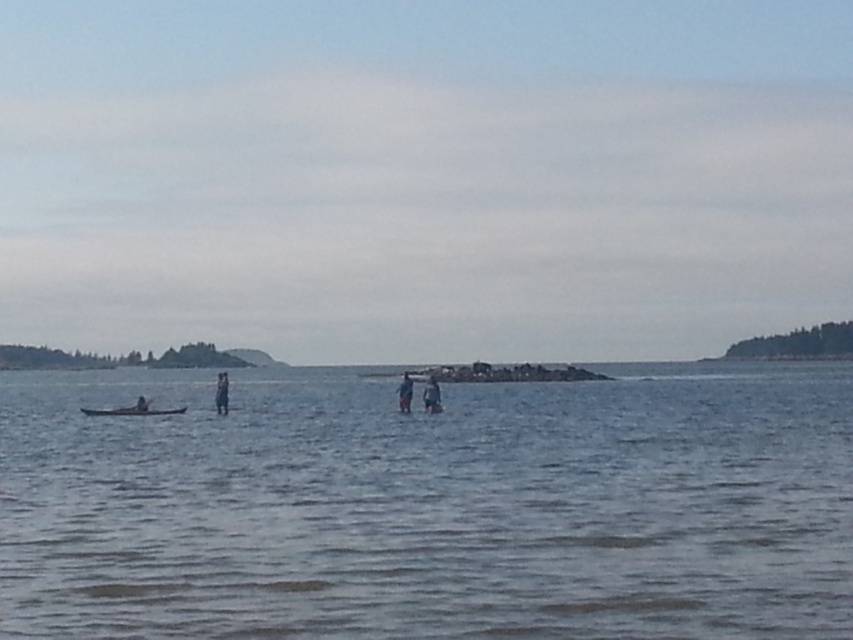
You are a photographer trying to capture the clear water at center and the dark blue fabric at center in the same frame. Based on their positions, which object should you adjust your camera to focus on first to ensure both are in the shot?

The clear water at center is positioned on the left side of dark blue fabric at center. Therefore, you should focus on the dark blue fabric at center first since it is on the right and might be further away, ensuring both are captured in the frame.

You are a photographer trying to capture the smooth brown canoe at lower left and the clear water at center in the same frame. Based on their positions, which one will occupy more horizontal space in the photo?

The clear water at center will occupy more horizontal space in the photo because its width surpasses that of the smooth brown canoe at lower left.

You are a photographer trying to capture a photo of the smooth brown canoe at lower left and the clear water at center. From your current position, which object should you adjust your camera to focus on first if you want to include both in the frame without moving your position?

The smooth brown canoe at lower left should be focused on first because it is closer to the photographer than the clear water at center, which is further away.